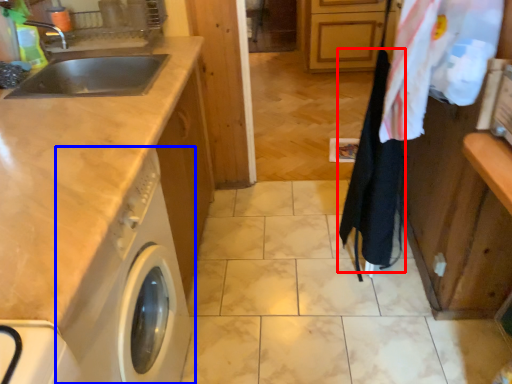
Question: Which object is further to the camera taking this photo, clothesline (highlighted by a red box) or washing machine (highlighted by a blue box)?

Choices:
 (A) clothesline
 (B) washing machine

Answer: (A)